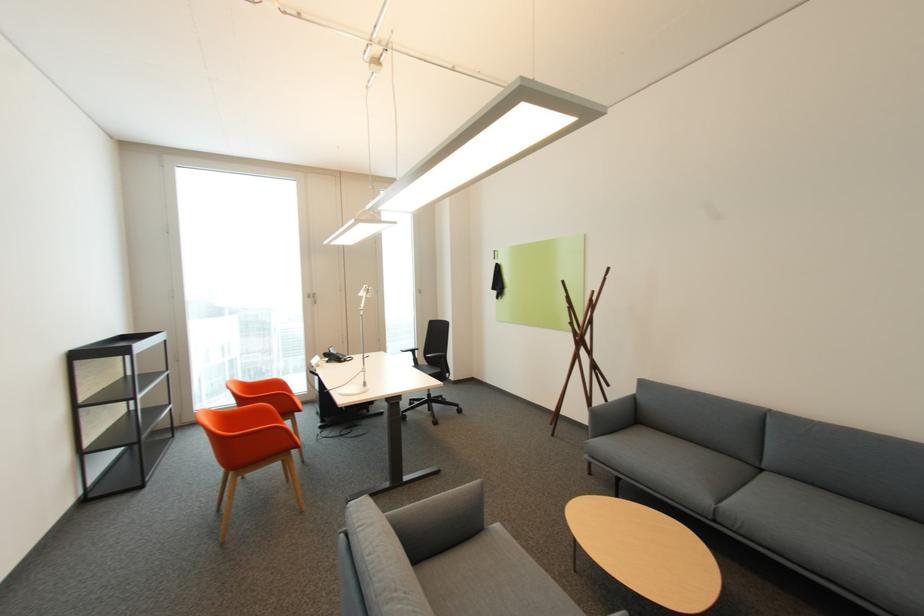
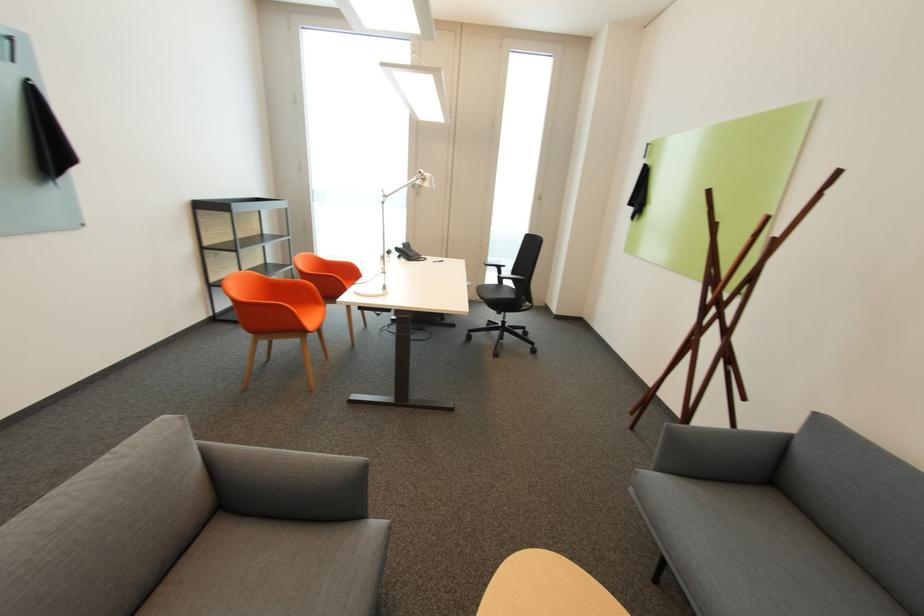
Where in the second image is the point corresponding to the point at 417,353 from the first image?

(503, 269)